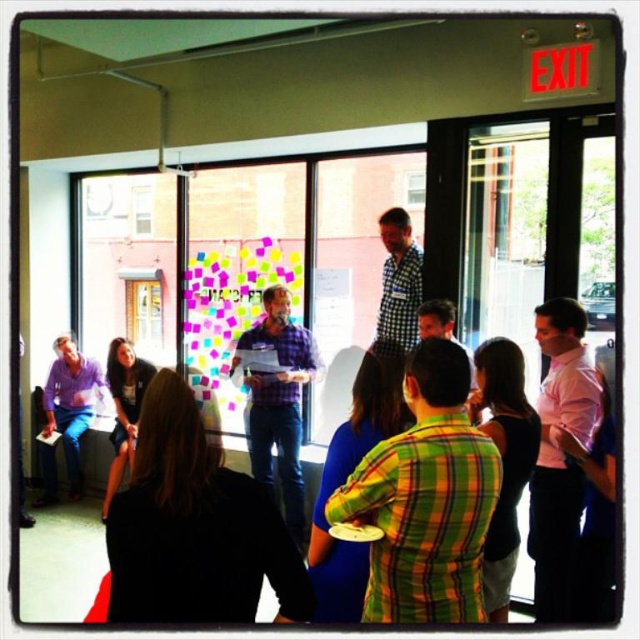
You are attending a meeting and need to locate the two presenters. The green plaid shirt at center and the pink shirt at right are the presenters. Which presenter is positioned to the left when facing the group?

The green plaid shirt at center is positioned to the left of the pink shirt at right when facing the group.

You are standing at the entrance of the room and want to approach the green plaid shirt at center. What direction should you move in to reach them?

Since the green plaid shirt at center is located at point 0.780 on the x axis and 0.666 on the y axis, you should move towards the center of the room to reach them.